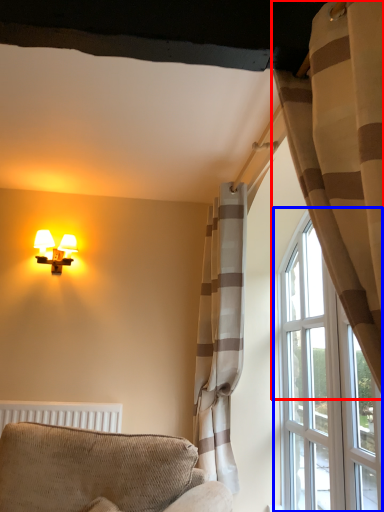
Question: Which point is further to the camera, curtain (highlighted by a red box) or window (highlighted by a blue box)?

Choices:
 (A) curtain
 (B) window

Answer: (B)